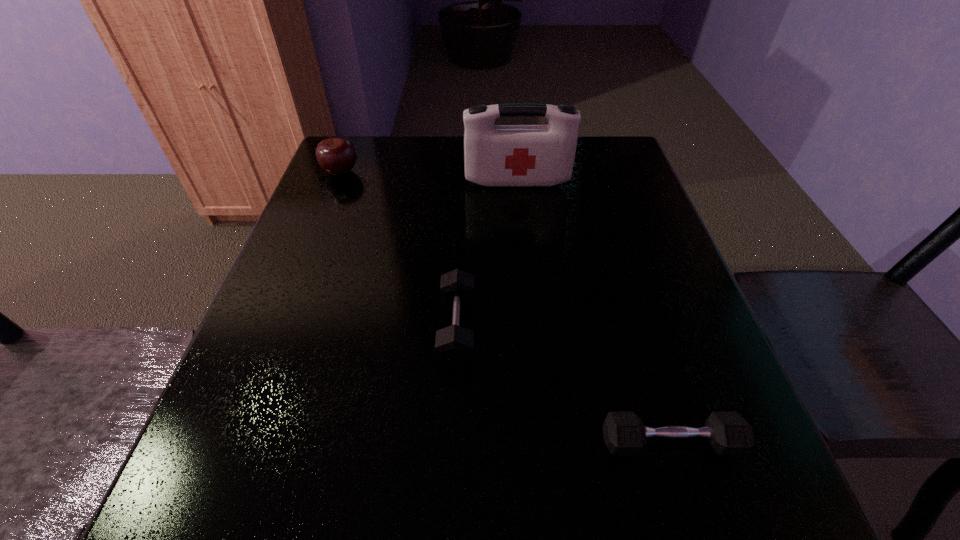
Find the location of a particular element. The image size is (960, 540). the first-aid kit is located at coordinates (494, 155).

You are a GUI agent. You are given a task and a screenshot of the screen. Output one action in this format:
    pyautogui.click(x=<x>, y=<y>)
    Task: Click on the apple
    Image resolution: width=960 pixels, height=540 pixels.
    Given the screenshot: What is the action you would take?
    pyautogui.click(x=337, y=156)

The width and height of the screenshot is (960, 540). Find the location of `the leftmost object`. the leftmost object is located at coordinates (337, 156).

Identify the location of the left dumbbell. (454, 345).

The image size is (960, 540). What are the coordinates of `the farther dumbbell` in the screenshot? It's located at (454, 345).

You are a GUI agent. You are given a task and a screenshot of the screen. Output one action in this format:
    pyautogui.click(x=<x>, y=<y>)
    Task: Click on the right dumbbell
    
    Given the screenshot: What is the action you would take?
    pyautogui.click(x=624, y=433)

Find the location of `the nearest object`. the nearest object is located at coordinates (624, 433).

Locate an element on the screen. The width and height of the screenshot is (960, 540). free region located 0.340m on the front side of the first-aid kit is located at coordinates (529, 289).

Identify the location of free region located on the right of the leftmost object. (418, 172).

The image size is (960, 540). Find the location of `blank space located on the right of the taller dumbbell`. blank space located on the right of the taller dumbbell is located at coordinates (680, 328).